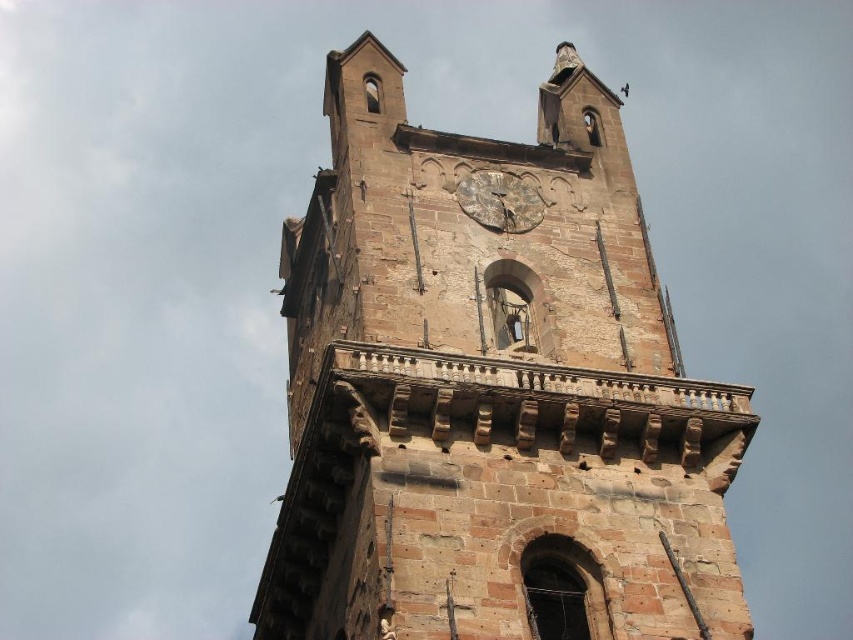
Question: Which point is closer to the camera?

Choices:
 (A) rusty metal clock at center
 (B) brown stone clock tower at center

Answer: (B)

Question: Does brown stone clock tower at center have a lesser width compared to rusty metal clock at center?

Choices:
 (A) yes
 (B) no

Answer: (B)

Question: Which object appears closest to the camera in this image?

Choices:
 (A) brown stone clock tower at center
 (B) rusty metal clock at center

Answer: (A)

Question: Which point appears farthest from the camera in this image?

Choices:
 (A) (521, 193)
 (B) (376, 292)

Answer: (A)

Question: Can you confirm if brown stone clock tower at center is smaller than rusty metal clock at center?

Choices:
 (A) no
 (B) yes

Answer: (A)

Question: Is brown stone clock tower at center to the left of rusty metal clock at center from the viewer's perspective?

Choices:
 (A) no
 (B) yes

Answer: (A)